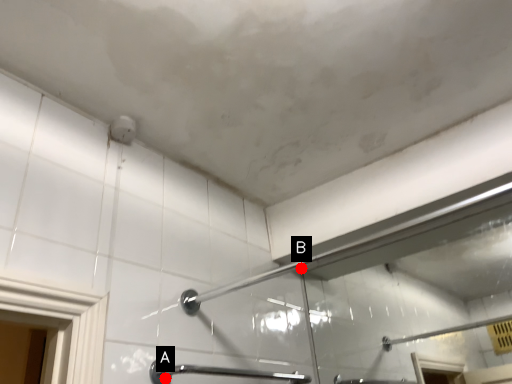
Question: Two points are circled on the image, labeled by A and B beside each circle. Among these points, which one is nearest to the camera?

Choices:
 (A) A is closer
 (B) B is closer

Answer: (A)